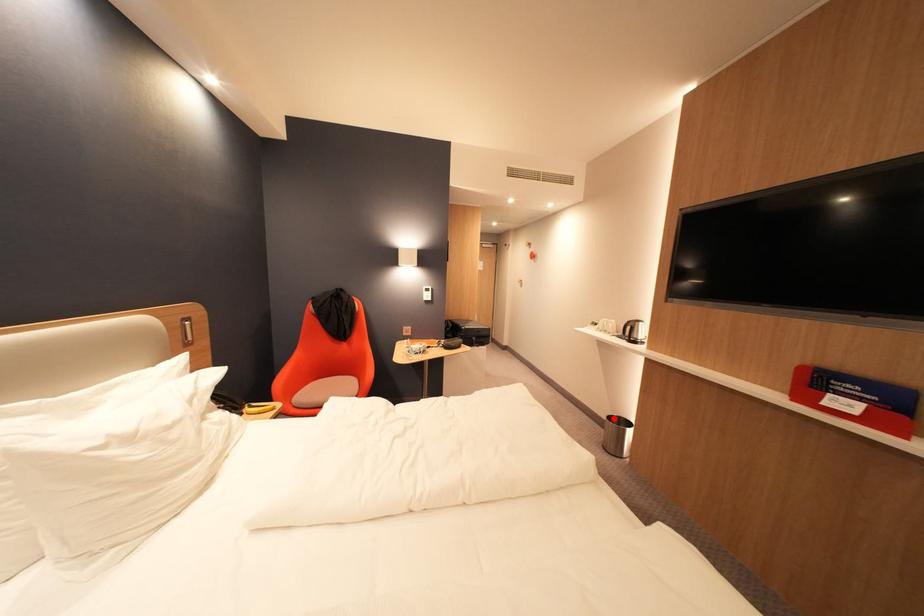
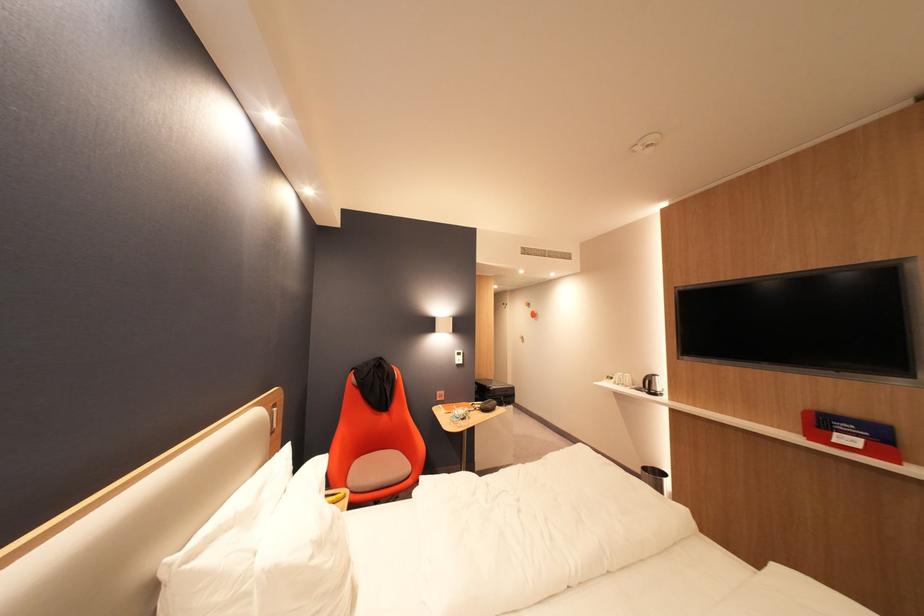
Question: I am providing you with two images of the same scene from different viewpoints. Image1 has a red point marked. In image2, the corresponding 3D location appears at what relative position? Reply with the corresponding letter.

Choices:
 (A) Closer
 (B) Farther

Answer: (B)